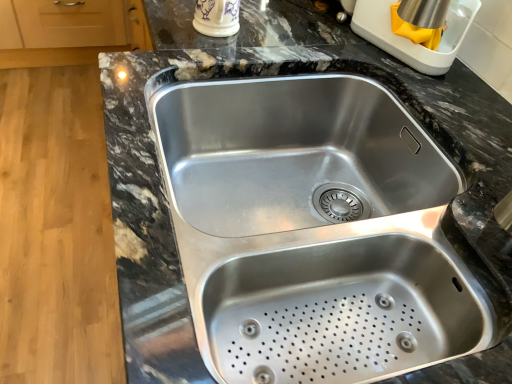
Locate an element on the screen. Image resolution: width=512 pixels, height=384 pixels. vacant space underneath stainless steel kettle at upper right, which ranks as the first appliance in right-to-left order (from a real-world perspective) is located at coordinates (389, 54).